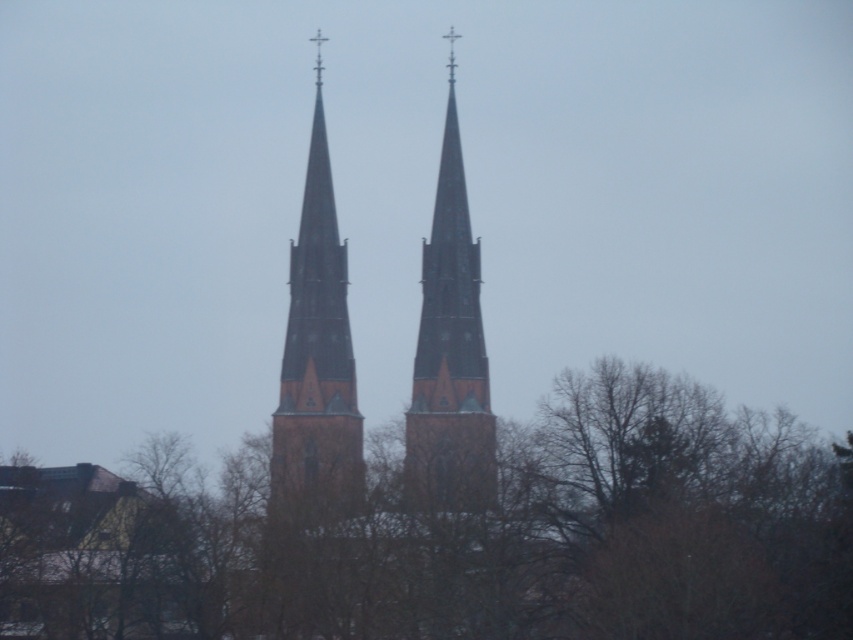
Question: Observing the image, what is the correct spatial positioning of brown leafless tree at center in reference to dark brown stone tower at center?

Choices:
 (A) below
 (B) above

Answer: (A)

Question: Which point is closer to the camera?

Choices:
 (A) (447, 243)
 (B) (270, 493)
 (C) (686, 493)

Answer: (C)

Question: Does brown leafless tree at center have a larger size compared to brown stone tower at center?

Choices:
 (A) yes
 (B) no

Answer: (A)

Question: Is dark brown stone tower at center thinner than brown stone tower at center?

Choices:
 (A) yes
 (B) no

Answer: (B)

Question: Estimate the real-world distances between objects in this image. Which object is closer to the brown stone tower at center?

Choices:
 (A) brown leafless tree at center
 (B) dark brown stone tower at center

Answer: (B)

Question: Which point appears farthest from the camera in this image?

Choices:
 (A) (274, 598)
 (B) (320, 195)

Answer: (B)